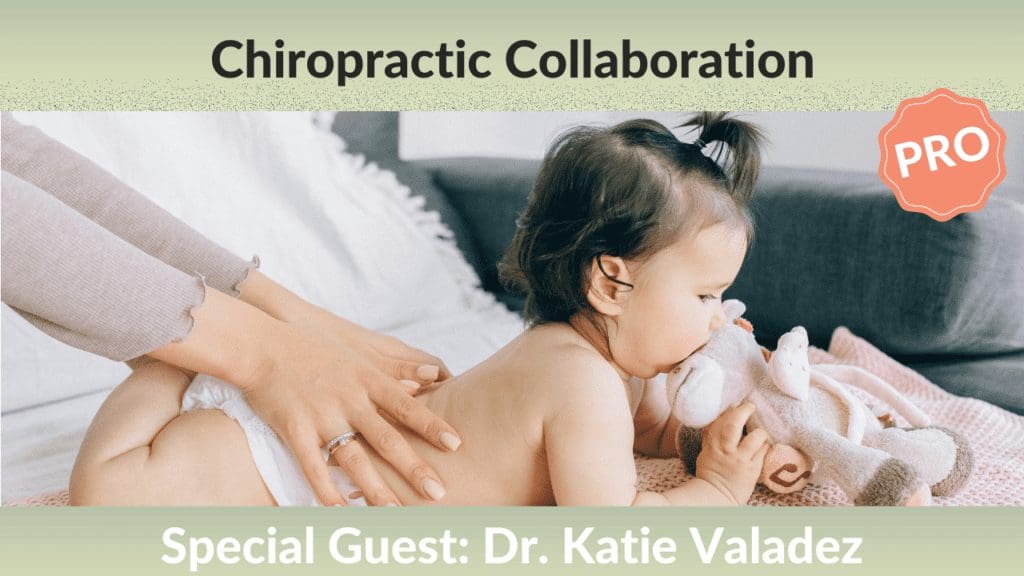
The height and width of the screenshot is (576, 1024). I want to click on tan blanket, so click(1002, 423), click(986, 475), click(815, 497), click(49, 500).